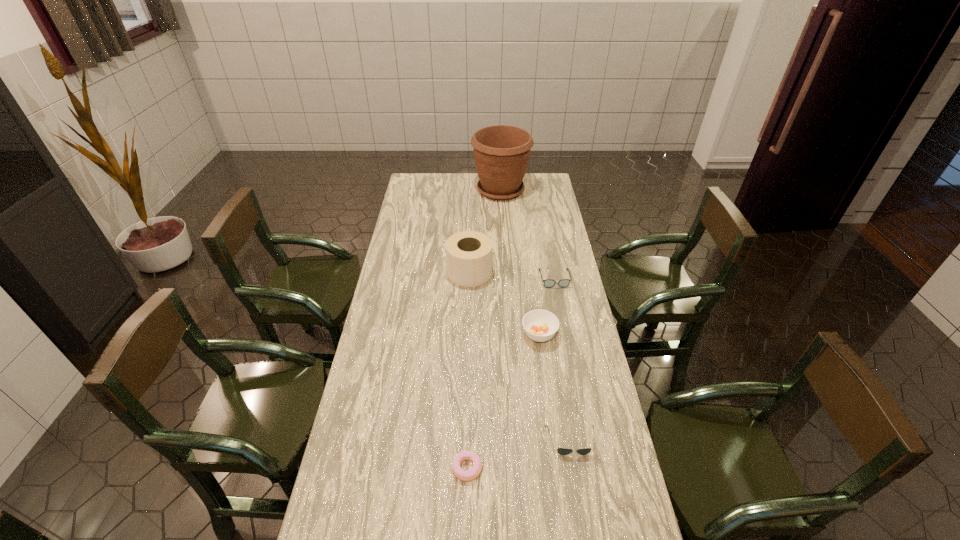
In the image, there is a desktop. Identify the location of vacant space at the left edge. The width and height of the screenshot is (960, 540). (390, 330).

You are a GUI agent. You are given a task and a screenshot of the screen. Output one action in this format:
    pyautogui.click(x=<x>, y=<y>)
    Task: Click on the vacant space at the right edge of the desktop
    This screenshot has width=960, height=540.
    Given the screenshot: What is the action you would take?
    [x=603, y=403]

Image resolution: width=960 pixels, height=540 pixels. Identify the location of free location at the far left corner of the desktop. (409, 189).

Find the location of `empty location between the spectacles and the fourth farthest object`. empty location between the spectacles and the fourth farthest object is located at coordinates (547, 307).

Identify the location of vacant area between the sunglasses and the doughnut. This screenshot has height=540, width=960. (519, 454).

The image size is (960, 540). Identify the location of vacant space that is in between the toilet tissue and the tallest object. (485, 231).

Identify the location of empty space between the sunglasses and the fifth shortest object. point(520,356).

Where is `unoccupied area between the spectacles and the fourth shortest object`? This screenshot has height=540, width=960. unoccupied area between the spectacles and the fourth shortest object is located at coordinates [x=547, y=307].

Locate an element on the screen. The width and height of the screenshot is (960, 540). vacant region between the toilet tissue and the fourth farthest object is located at coordinates (504, 303).

This screenshot has width=960, height=540. In order to click on unoccupied area between the doughnut and the tallest object in this screenshot , I will do `click(484, 329)`.